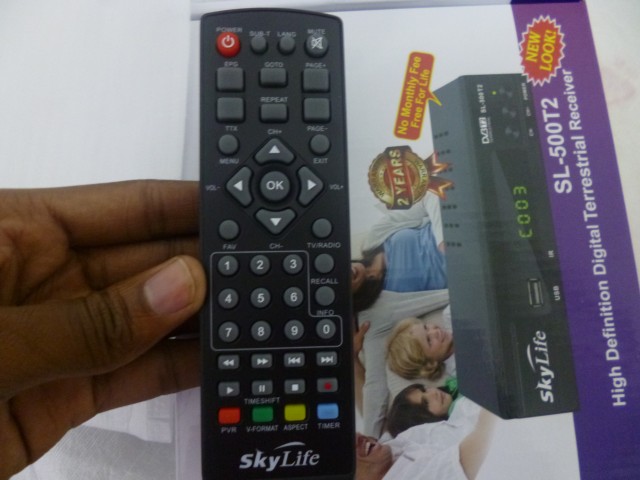
Locate an element on the screen. mute (grey) button is located at coordinates (320, 44).